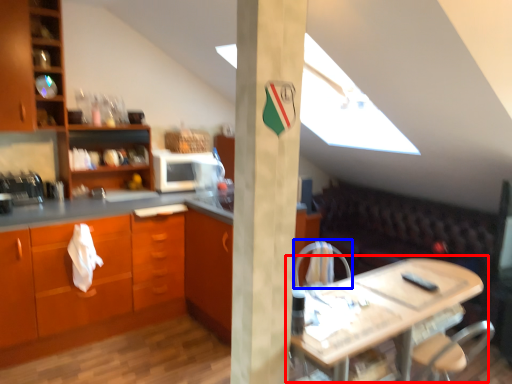
Question: Which object appears farthest to the camera in this image, table (highlighted by a red box) or armchair (highlighted by a blue box)?

Choices:
 (A) table
 (B) armchair

Answer: (B)